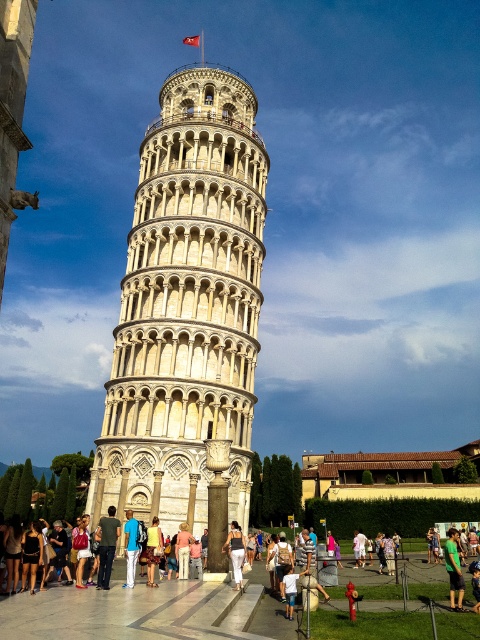
Which is above, blue denim jeans at lower center or white cotton shirt at center?

blue denim jeans at lower center is higher up.

I want to click on blue denim jeans at lower center, so click(153, 548).

Identify the location of blue denim jeans at lower center. This screenshot has height=640, width=480. (153, 548).

Can you confirm if blue denim jeans at center is shorter than pink fabric purse at center?

Indeed, blue denim jeans at center has a lesser height compared to pink fabric purse at center.

Does blue denim jeans at center appear under pink fabric purse at center?

Yes, blue denim jeans at center is below pink fabric purse at center.

This screenshot has height=640, width=480. I want to click on blue denim jeans at center, so click(x=107, y=545).

Does point (233, 452) lie in front of point (113, 545)?

No, (233, 452) is behind (113, 545).

Does white stone tower at center lie in front of blue denim jeans at center?

No.

This screenshot has width=480, height=640. I want to click on white stone tower at center, so click(188, 312).